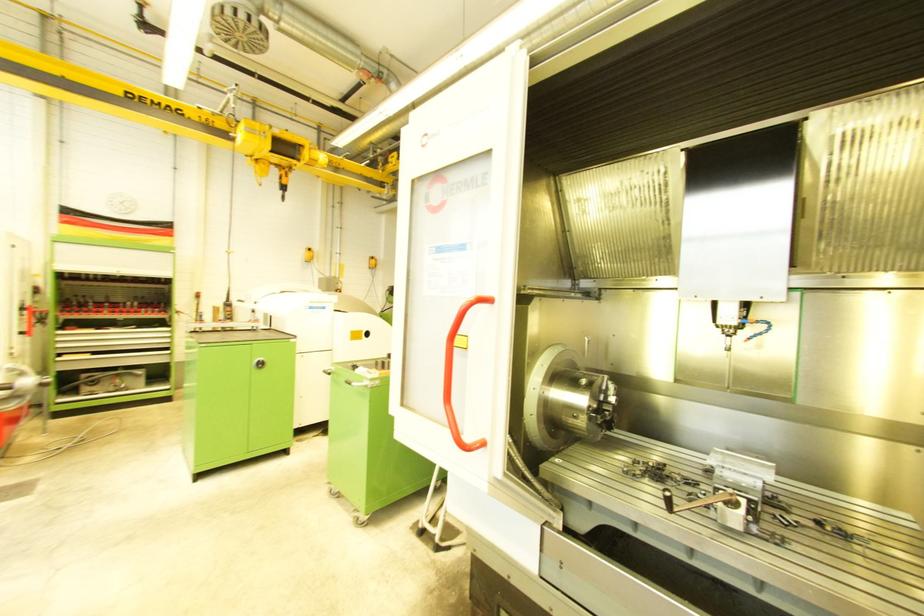
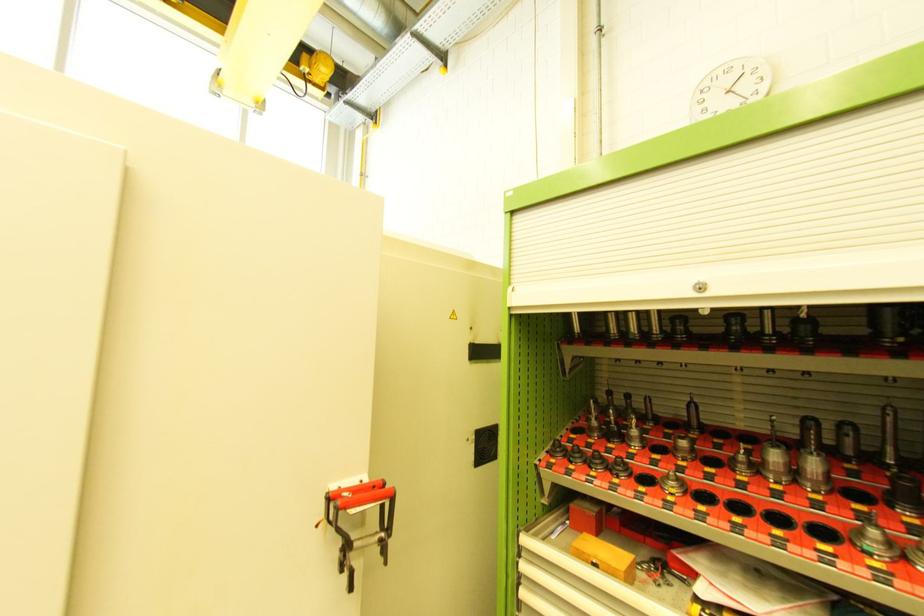
In the second image, find the point that corresponds to pixel 131 305 in the first image.

(777, 458)